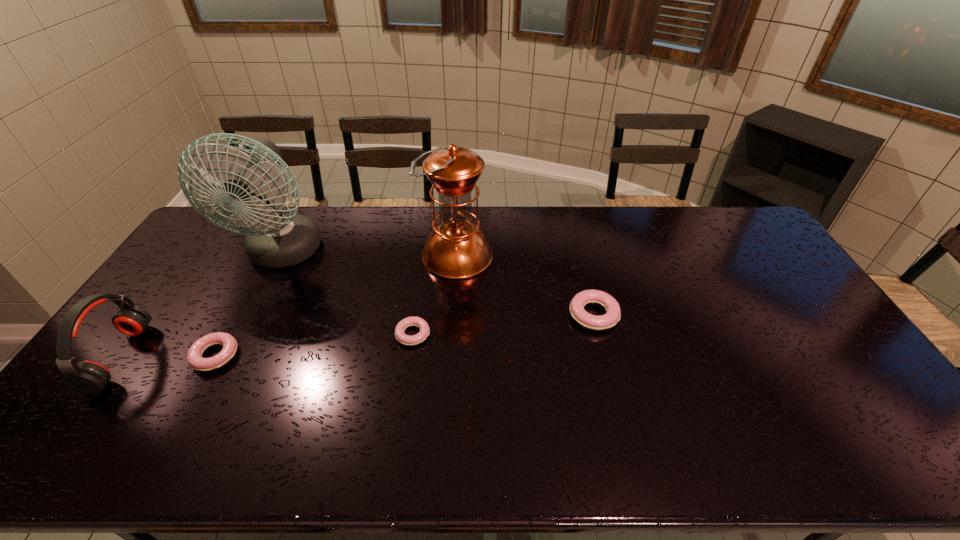
Locate an element on the screen. This screenshot has height=540, width=960. object present at the near left corner is located at coordinates (88, 377).

The image size is (960, 540). Find the location of `vacant space at the far edge of the desktop`. vacant space at the far edge of the desktop is located at coordinates (685, 210).

Locate an element on the screen. free space at the near edge of the desktop is located at coordinates (453, 407).

At what (x,y) coordinates should I click in order to perform the action: click on vacant area at the left edge of the desktop. Please return your answer as a coordinate pair (x, y). Looking at the image, I should click on (175, 275).

The width and height of the screenshot is (960, 540). In the image, there is a desktop. Find the location of `vacant region at the right edge`. vacant region at the right edge is located at coordinates (792, 285).

This screenshot has height=540, width=960. Identify the location of vacant space at the far right corner of the desktop. (739, 214).

Find the location of a particular element. This screenshot has height=540, width=960. free area in between the fan and the second shortest object is located at coordinates (249, 305).

Identify the location of free area in between the third shortest object and the oil lamp. (525, 286).

The image size is (960, 540). I want to click on vacant space that is in between the rightmost object and the fan, so click(x=438, y=285).

Locate an element on the screen. The width and height of the screenshot is (960, 540). vacant area between the fourth shortest object and the fan is located at coordinates (202, 306).